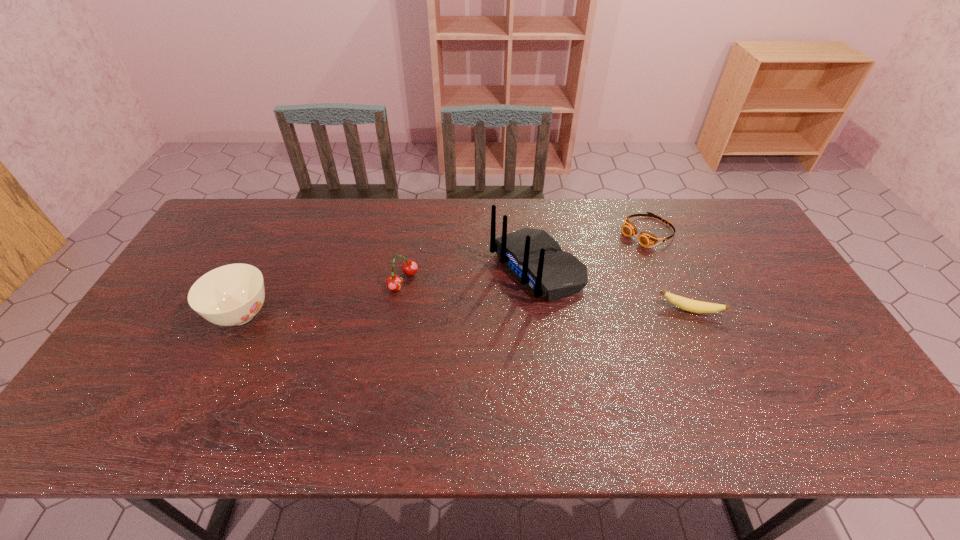
You are a GUI agent. You are given a task and a screenshot of the screen. Output one action in this format:
    pyautogui.click(x=<x>, y=<y>)
    Task: Click on the vacant space located on the back of the router
    This screenshot has height=540, width=960.
    Given the screenshot: What is the action you would take?
    pyautogui.click(x=371, y=347)

Where is `blank area located 0.060m with the lenses facing forward on the goggles`? This screenshot has width=960, height=540. blank area located 0.060m with the lenses facing forward on the goggles is located at coordinates (618, 251).

Where is `free space located with the lenses facing forward on the goggles`? The image size is (960, 540). free space located with the lenses facing forward on the goggles is located at coordinates (570, 285).

Locate an element on the screen. The height and width of the screenshot is (540, 960). free space located 0.050m with the lenses facing forward on the goggles is located at coordinates (620, 250).

You are a GUI agent. You are given a task and a screenshot of the screen. Output one action in this format:
    pyautogui.click(x=<x>, y=<y>)
    Task: Click on the free region located with stems pointing upwards on the cherry
    The image size is (960, 540).
    Given the screenshot: What is the action you would take?
    pyautogui.click(x=521, y=343)

Find the location of a particular element. This screenshot has width=960, height=540. free space located with stems pointing upwards on the cherry is located at coordinates pyautogui.click(x=480, y=322).

At what (x,y) coordinates should I click in order to perform the action: click on vacant area located with stems pointing upwards on the cherry. Please return your answer as a coordinate pair (x, y). This screenshot has width=960, height=540. Looking at the image, I should click on (470, 318).

At what (x,y) coordinates should I click in order to perform the action: click on router at the far edge. Please return your answer as a coordinate pair (x, y). This screenshot has width=960, height=540. Looking at the image, I should click on (535, 259).

At what (x,y) coordinates should I click in order to perform the action: click on goggles that is at the far edge. Please return your answer as a coordinate pair (x, y). Looking at the image, I should click on (646, 239).

This screenshot has height=540, width=960. I want to click on object present at the left edge, so click(230, 295).